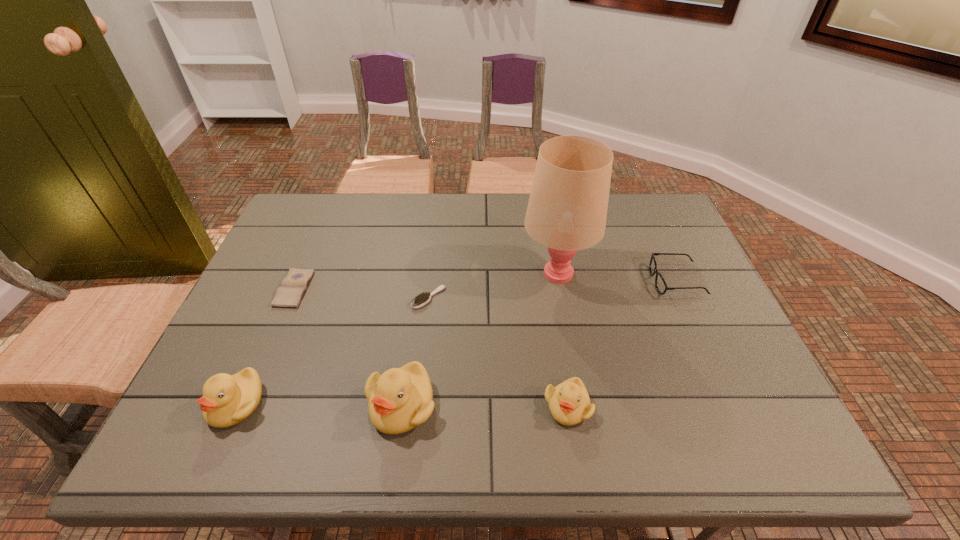
Please point a vacant point for placing a duckling on the right. Please provide its 2D coordinates. Your answer should be formatted as a tuple, i.e. [(x, y)], where the tuple contains the x and y coordinates of a point satisfying the conditions above.

[(734, 408)]